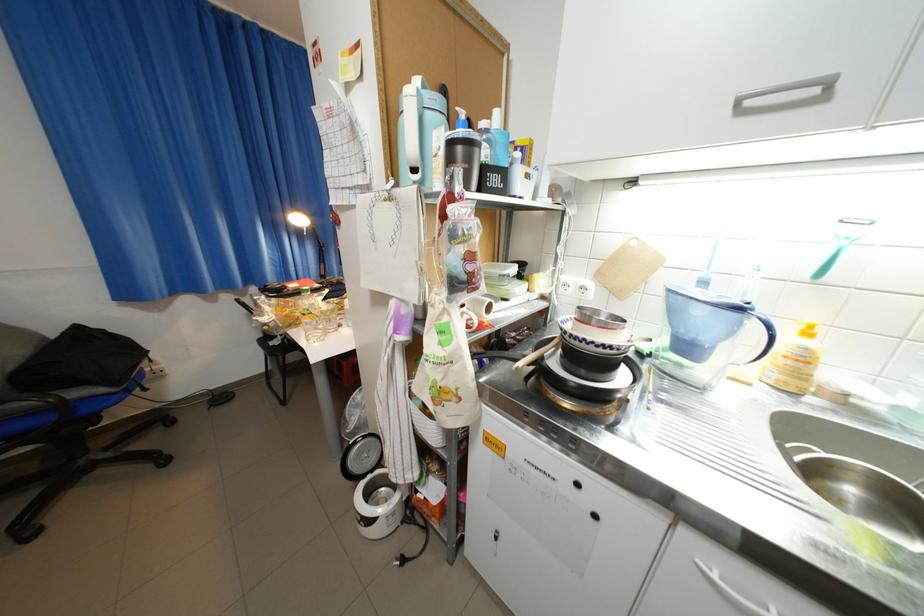
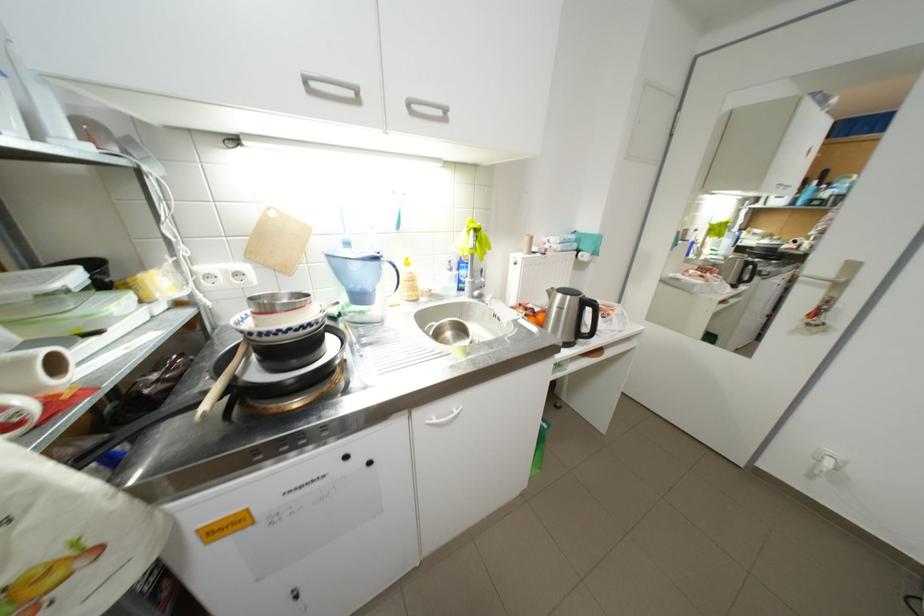
Where in the second image is the point corresponding to point (727, 573) from the first image?

(445, 419)